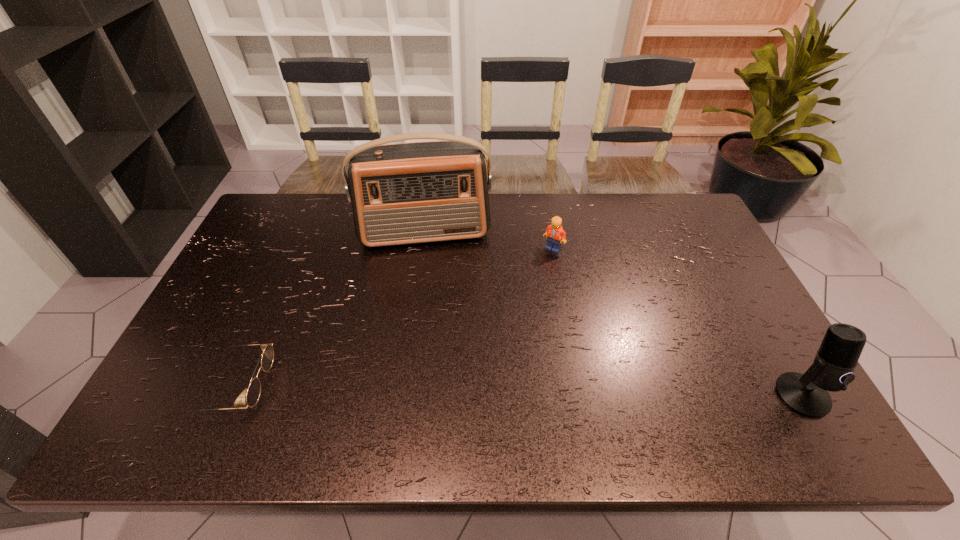
Find the location of a particular element. vacant area between the sunglasses and the microphone is located at coordinates (519, 391).

The width and height of the screenshot is (960, 540). Find the location of `free point between the third tallest object and the shortest object`. free point between the third tallest object and the shortest object is located at coordinates (396, 318).

The image size is (960, 540). I want to click on free point between the third object from left to right and the second tallest object, so click(678, 322).

Find the location of a particular element. This screenshot has height=540, width=960. free space between the shortest object and the tallest object is located at coordinates (331, 310).

Locate an element on the screen. The height and width of the screenshot is (540, 960). free space that is in between the third shortest object and the sunglasses is located at coordinates (519, 391).

Image resolution: width=960 pixels, height=540 pixels. I want to click on free spot between the shortest object and the rightmost object, so [x=519, y=391].

Locate an element on the screen. The image size is (960, 540). vacant area that lies between the Lego and the rightmost object is located at coordinates (678, 322).

Where is `vacant area that lies between the rightmost object and the tallest object`? vacant area that lies between the rightmost object and the tallest object is located at coordinates (613, 315).

You are a GUI agent. You are given a task and a screenshot of the screen. Output one action in this format:
    pyautogui.click(x=<x>, y=<y>)
    Task: Click on the third closest object to the microphone
    This screenshot has width=960, height=540.
    Given the screenshot: What is the action you would take?
    pyautogui.click(x=253, y=393)

The image size is (960, 540). Find the location of `object identified as the third closest to the Lego`. object identified as the third closest to the Lego is located at coordinates (253, 393).